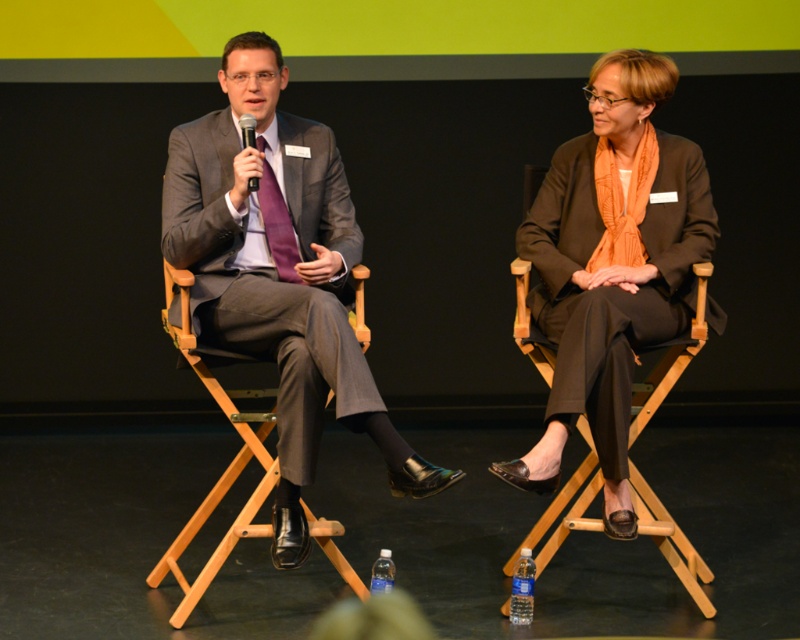
Between point (277, 125) and point (256, 188), which one is positioned in front?

Positioned in front is point (256, 188).

Does matte gray suit at left appear over black plastic microphone at center?

No, matte gray suit at left is not above black plastic microphone at center.

The image size is (800, 640). I want to click on matte gray suit at left, so [270, 275].

Identify the location of matte gray suit at left. Image resolution: width=800 pixels, height=640 pixels. (270, 275).

Is matte gray suit at left above wooden chair at center?

Yes.

Between point (242, 348) and point (162, 568), which one is positioned behind?

Positioned behind is point (162, 568).

Find the location of a particular element. The image size is (800, 640). matte gray suit at left is located at coordinates (270, 275).

Based on the photo, between matte black suit at right and matte gray suit at left, which one has more height?

matte black suit at right is taller.

Who is shorter, matte black suit at right or matte gray suit at left?

With less height is matte gray suit at left.

Between point (521, 474) and point (208, 218), which one is positioned behind?

Positioned behind is point (521, 474).

The width and height of the screenshot is (800, 640). I want to click on matte black suit at right, so click(612, 266).